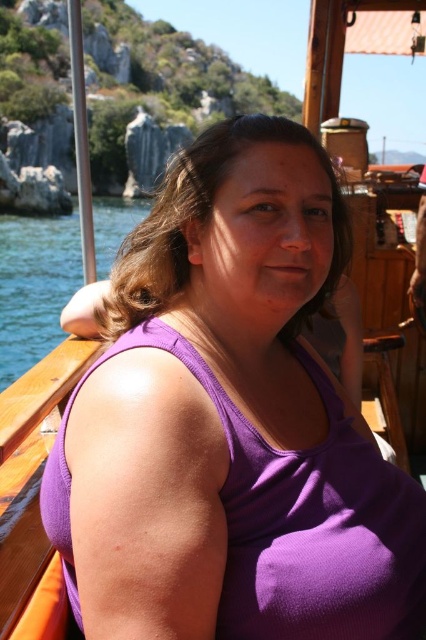
Question: Which of the following is the closest to the observer?

Choices:
 (A) purple fabric tank top at center
 (B) blue water at left

Answer: (A)

Question: Considering the relative positions of purple fabric tank top at center and blue water at left in the image provided, where is purple fabric tank top at center located with respect to blue water at left?

Choices:
 (A) below
 (B) above

Answer: (A)

Question: Does purple fabric tank top at center have a smaller size compared to blue water at left?

Choices:
 (A) yes
 (B) no

Answer: (A)

Question: Observing the image, what is the correct spatial positioning of purple fabric tank top at center in reference to blue water at left?

Choices:
 (A) below
 (B) above

Answer: (A)

Question: Among these objects, which one is farthest from the camera?

Choices:
 (A) purple fabric tank top at center
 (B) blue water at left

Answer: (B)

Question: Which of the following is the closest to the observer?

Choices:
 (A) (3, 260)
 (B) (249, 554)

Answer: (B)